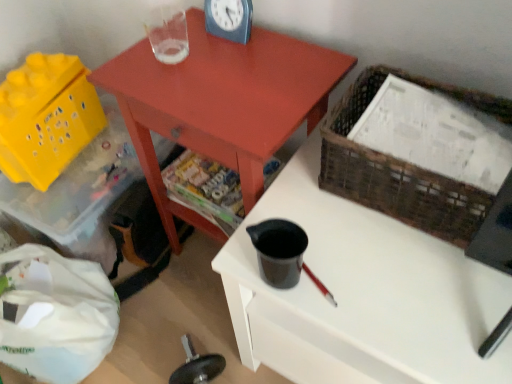
Where is `vacant space in front of woven brown basket at upper right, the first basket viewed from the front`? vacant space in front of woven brown basket at upper right, the first basket viewed from the front is located at coordinates (421, 296).